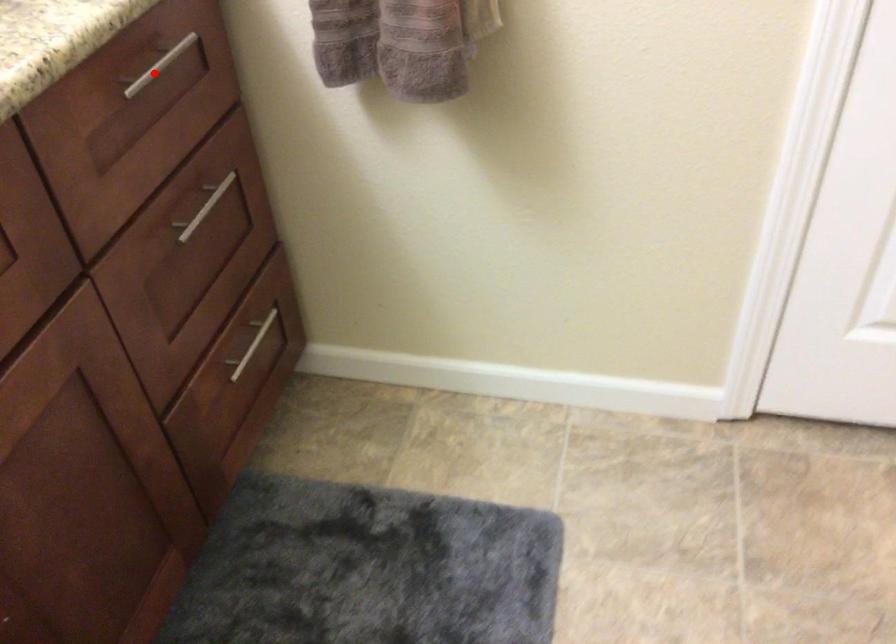
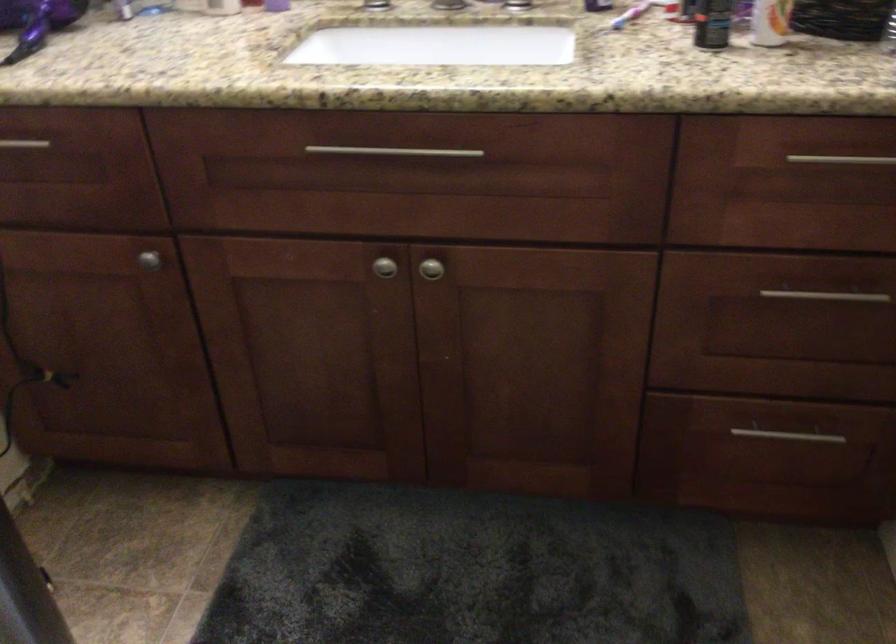
Find the pixel in the second image that matches the highlighted location in the first image.

(841, 158)